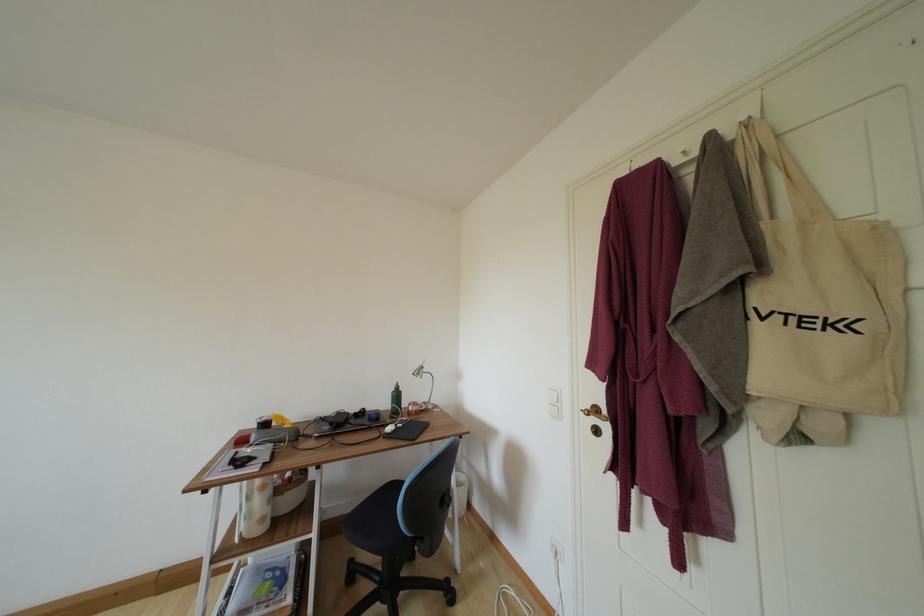
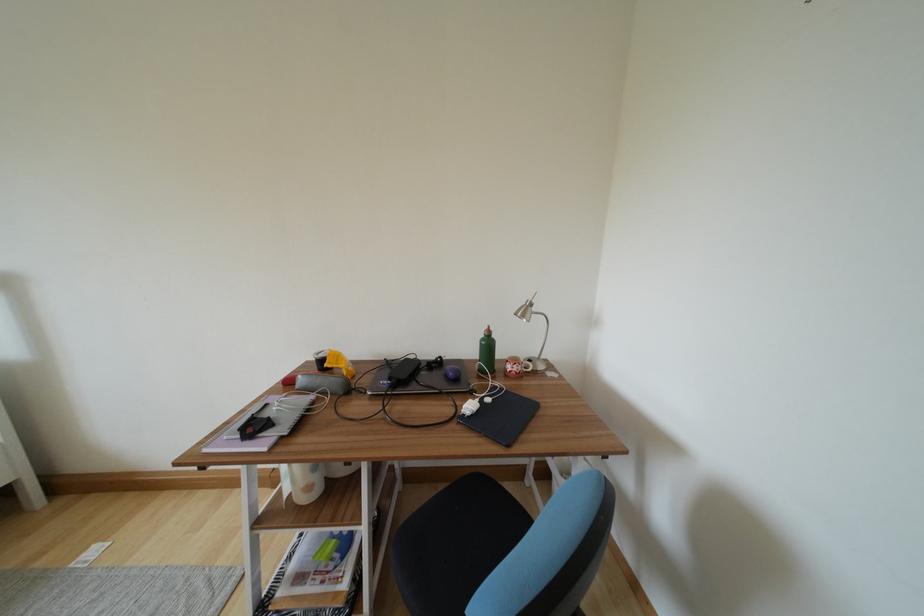
Locate, in the second image, the point that corresponds to point 371,421 in the first image.

(448, 376)